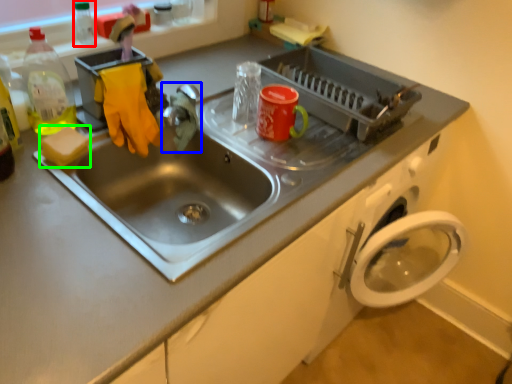
Question: Which is nearer to the bottle (highlighted by a red box)? faucet (highlighted by a blue box) or soap (highlighted by a green box).

Choices:
 (A) faucet
 (B) soap

Answer: (A)